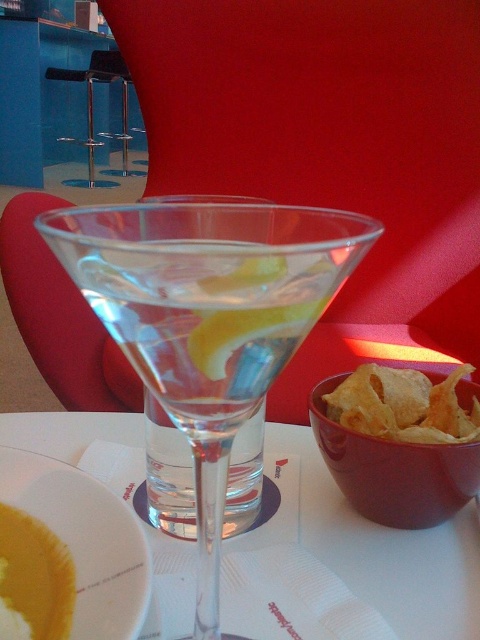
Question: Does matte ceramic bowl at lower right come behind golden crispy chips at right?

Choices:
 (A) yes
 (B) no

Answer: (B)

Question: Which point is farther to the camera?

Choices:
 (A) (136, 240)
 (B) (4, 525)
 (C) (384, 522)

Answer: (C)

Question: Is transparent glass at center to the right of matte ceramic bowl at lower right from the viewer's perspective?

Choices:
 (A) yes
 (B) no

Answer: (B)

Question: Does yellow matte plate at lower left have a lesser width compared to yellow matte soup at lower left?

Choices:
 (A) yes
 (B) no

Answer: (B)

Question: Which of these objects is positioned farthest from the matte ceramic bowl at lower right?

Choices:
 (A) golden crispy chips at right
 (B) transparent glass at center
 (C) yellow matte plate at lower left
 (D) transparent glass martini at center

Answer: (D)

Question: Among these objects, which one is nearest to the camera?

Choices:
 (A) clear glass martini at center
 (B) golden crispy chips at right
 (C) yellow matte plate at lower left
 (D) transparent glass martini at center

Answer: (D)